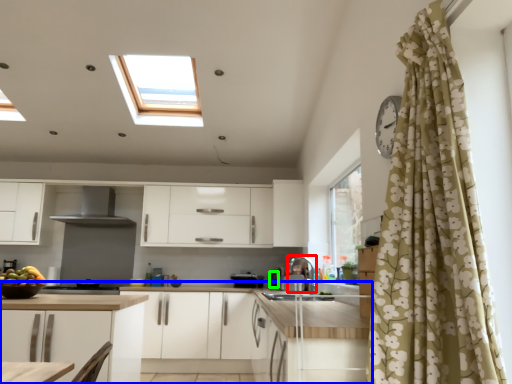
Question: Considering the real-world distances, which object is farthest from appliance (highlighted by a red box)? countertop (highlighted by a blue box) or appliance (highlighted by a green box)?

Choices:
 (A) countertop
 (B) appliance

Answer: (A)